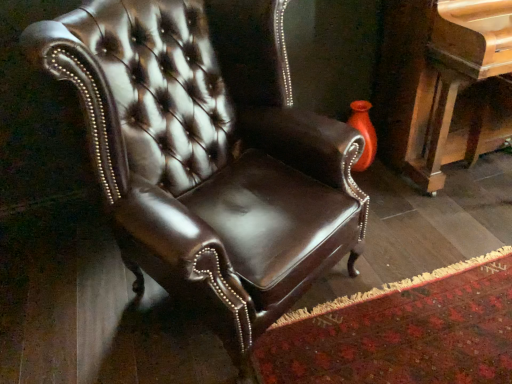
Question: In terms of width, does shiny brown leather chair at center look wider or thinner when compared to polished wood piano at right?

Choices:
 (A) thin
 (B) wide

Answer: (B)

Question: In the image, is shiny brown leather chair at center positioned in front of or behind polished wood piano at right?

Choices:
 (A) front
 (B) behind

Answer: (A)

Question: Is shiny brown leather chair at center inside or outside of polished wood piano at right?

Choices:
 (A) inside
 (B) outside

Answer: (B)

Question: From the image's perspective, is polished wood piano at right located above or below shiny brown leather chair at center?

Choices:
 (A) above
 (B) below

Answer: (A)

Question: From a real-world perspective, relative to shiny brown leather chair at center, is polished wood piano at right vertically above or below?

Choices:
 (A) above
 (B) below

Answer: (B)

Question: In terms of size, does polished wood piano at right appear bigger or smaller than shiny brown leather chair at center?

Choices:
 (A) small
 (B) big

Answer: (A)

Question: Considering the positions of polished wood piano at right and shiny brown leather chair at center in the image, is polished wood piano at right wider or thinner than shiny brown leather chair at center?

Choices:
 (A) wide
 (B) thin

Answer: (B)